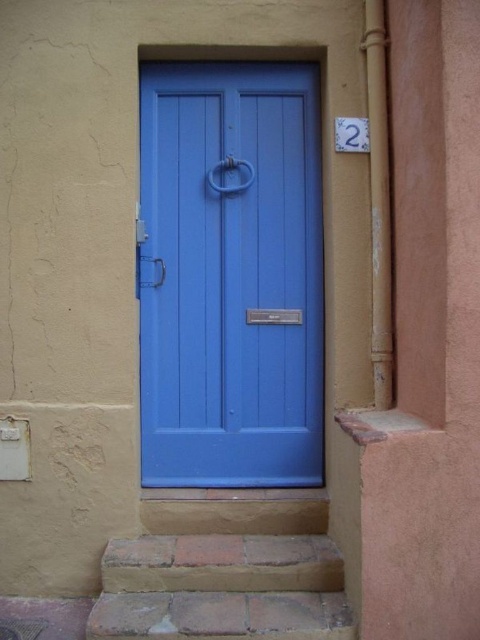
Question: Which object is farther from the camera taking this photo?

Choices:
 (A) brick/stone stairs at lower center
 (B) matte wood door at center

Answer: (B)

Question: Is matte wood door at center positioned before brick/stone stairs at lower center?

Choices:
 (A) no
 (B) yes

Answer: (A)

Question: Is matte wood door at center smaller than brick/stone stairs at lower center?

Choices:
 (A) no
 (B) yes

Answer: (B)

Question: Is matte wood door at center behind brick/stone stairs at lower center?

Choices:
 (A) yes
 (B) no

Answer: (A)